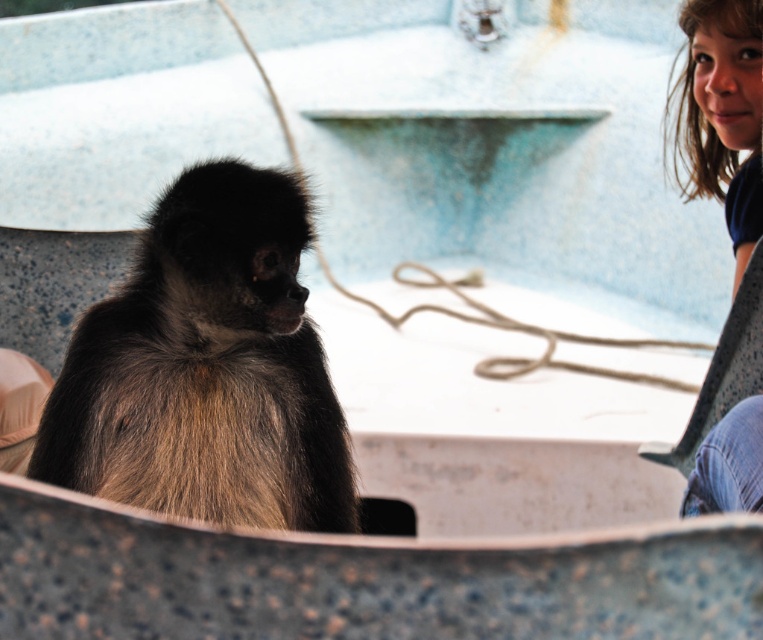
You are a zookeeper observing the spider monkey in the pool. You notice the brown furry monkey at center and the blue denim jeans at lower right. Which object is smaller in size?

The brown furry monkey at center is smaller in size compared to the blue denim jeans at lower right.

You are observing a spider monkey in a pool. The monkey is at the center. A coiled rope is on the pool surface. Where is the brown furry monkey at center located in relation to the coiled rope?

The brown furry monkey at center is located at point (x=205, y=369), which is to the left and slightly below the coiled rope on the pool surface.